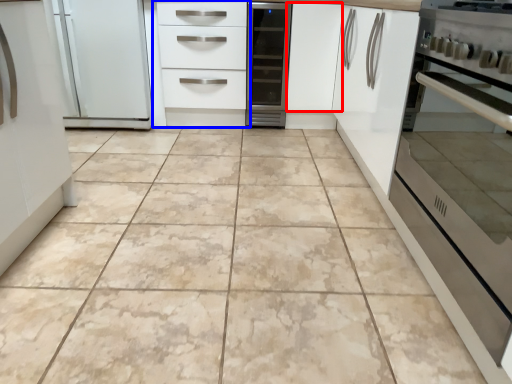
Question: Which object appears farthest to the camera in this image, cabinetry (highlighted by a red box) or chest of drawers (highlighted by a blue box)?

Choices:
 (A) cabinetry
 (B) chest of drawers

Answer: (A)